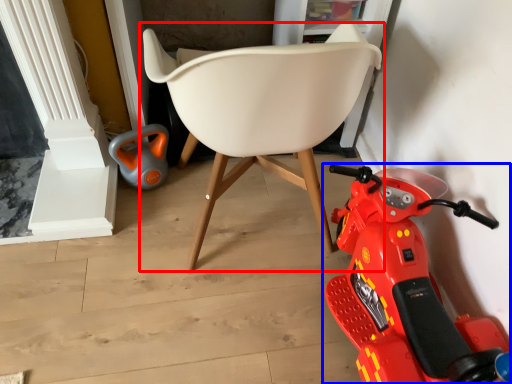
Question: Among these objects, which one is farthest to the camera, chair (highlighted by a red box) or land vehicle (highlighted by a blue box)?

Choices:
 (A) chair
 (B) land vehicle

Answer: (B)